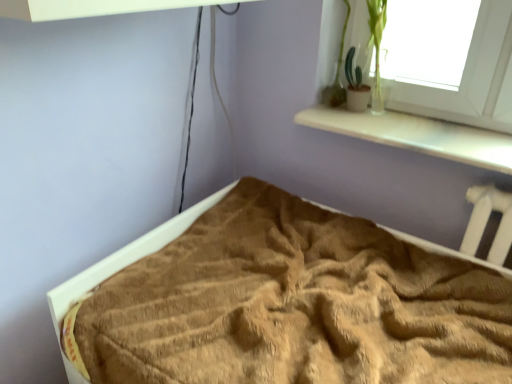
What do you see at coordinates (365, 57) in the screenshot? I see `green matte plant at upper right` at bounding box center [365, 57].

At what (x,y) coordinates should I click in order to perform the action: click on green matte plant at upper right. Please return your answer as a coordinate pair (x, y). Looking at the image, I should click on [365, 57].

Measure the distance between green matte plant at upper right and camera.

The depth of green matte plant at upper right is 4.83 feet.

In order to click on brown textured blanket at lower center in this screenshot , I will do `click(125, 258)`.

Image resolution: width=512 pixels, height=384 pixels. Describe the element at coordinates (125, 258) in the screenshot. I see `brown textured blanket at lower center` at that location.

Identify the location of green matte plant at upper right. This screenshot has height=384, width=512. (365, 57).

Would you say green matte plant at upper right is to the left or to the right of brown textured blanket at lower center in the picture?

Based on their positions, green matte plant at upper right is located to the right of brown textured blanket at lower center.

From the picture: Does green matte plant at upper right come behind brown textured blanket at lower center?

Yes, the depth of green matte plant at upper right is greater than that of brown textured blanket at lower center.

Is point (370, 38) closer to camera compared to point (57, 294)?

No, (370, 38) is further to viewer.

Looking at this image, from the image's perspective, which one is positioned lower, green matte plant at upper right or brown textured blanket at lower center?

brown textured blanket at lower center, from the image's perspective.

Looking at this image, from a real-world perspective, is green matte plant at upper right physically located above or below brown textured blanket at lower center?

green matte plant at upper right is above brown textured blanket at lower center.

Is green matte plant at upper right wider or thinner than brown textured blanket at lower center?

green matte plant at upper right is thinner than brown textured blanket at lower center.

Does green matte plant at upper right have a greater height compared to brown textured blanket at lower center?

Indeed, green matte plant at upper right has a greater height compared to brown textured blanket at lower center.

Considering the relative sizes of green matte plant at upper right and brown textured blanket at lower center in the image provided, is green matte plant at upper right smaller than brown textured blanket at lower center?

Yes.

Is brown textured blanket at lower center located within green matte plant at upper right?

No, brown textured blanket at lower center is not inside green matte plant at upper right.

Is green matte plant at upper right beside brown textured blanket at lower center?

No, green matte plant at upper right is not making contact with brown textured blanket at lower center.

Is green matte plant at upper right oriented away from brown textured blanket at lower center?

No.

Locate an element on the screen. plant that is behind the brown textured blanket at lower center is located at coordinates (365, 57).

Which object is positioned more to the right, brown textured blanket at lower center or green matte plant at upper right?

green matte plant at upper right.

Who is more distant, brown textured blanket at lower center or green matte plant at upper right?

green matte plant at upper right is more distant.

Is point (59, 343) in front of point (366, 14)?

Yes, it is.

From the image's perspective, between brown textured blanket at lower center and green matte plant at upper right, who is located below?

brown textured blanket at lower center is shown below in the image.

From a real-world perspective, which is physically above, brown textured blanket at lower center or green matte plant at upper right?

From a 3D spatial view, green matte plant at upper right is above.

Between brown textured blanket at lower center and green matte plant at upper right, which one has larger width?

brown textured blanket at lower center is wider.

Who is shorter, brown textured blanket at lower center or green matte plant at upper right?

brown textured blanket at lower center is shorter.

Who is bigger, brown textured blanket at lower center or green matte plant at upper right?

Bigger between the two is brown textured blanket at lower center.

Is brown textured blanket at lower center completely or partially outside of green matte plant at upper right?

Absolutely, brown textured blanket at lower center is external to green matte plant at upper right.

Is brown textured blanket at lower center not near green matte plant at upper right?

No, there isn't a large distance between brown textured blanket at lower center and green matte plant at upper right.

Is brown textured blanket at lower center oriented away from green matte plant at upper right?

That's not correct — brown textured blanket at lower center is not looking away from green matte plant at upper right.

You are a GUI agent. You are given a task and a screenshot of the screen. Output one action in this format:
    pyautogui.click(x=<x>, y=<y>)
    Task: Click on the plant behind the brown textured blanket at lower center
    This screenshot has width=512, height=384.
    Given the screenshot: What is the action you would take?
    pyautogui.click(x=365, y=57)

The height and width of the screenshot is (384, 512). What are the coordinates of `bed in front of the green matte plant at upper right` in the screenshot? It's located at (125, 258).

Identify the location of plant lying on the right of brown textured blanket at lower center. (365, 57).